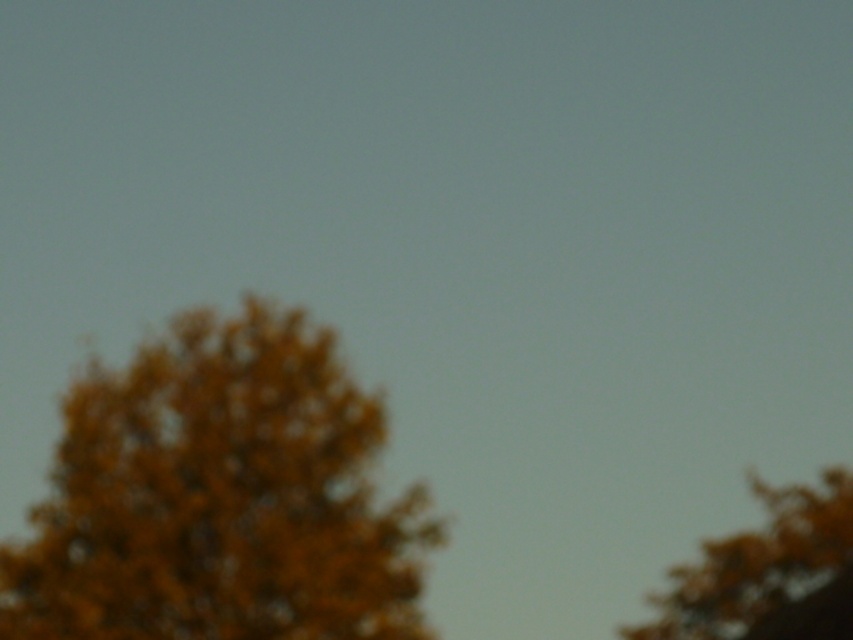
Question: Does orange fuzzy tree at left have a lesser width compared to golden textured leaves at upper right?

Choices:
 (A) yes
 (B) no

Answer: (B)

Question: Does orange fuzzy tree at left have a lesser width compared to golden textured leaves at upper right?

Choices:
 (A) yes
 (B) no

Answer: (B)

Question: Does orange fuzzy tree at left appear over golden textured leaves at upper right?

Choices:
 (A) yes
 (B) no

Answer: (A)

Question: Which point appears closest to the camera in this image?

Choices:
 (A) pyautogui.click(x=705, y=605)
 (B) pyautogui.click(x=61, y=547)

Answer: (B)

Question: Among these points, which one is nearest to the camera?

Choices:
 (A) (360, 404)
 (B) (790, 534)

Answer: (A)